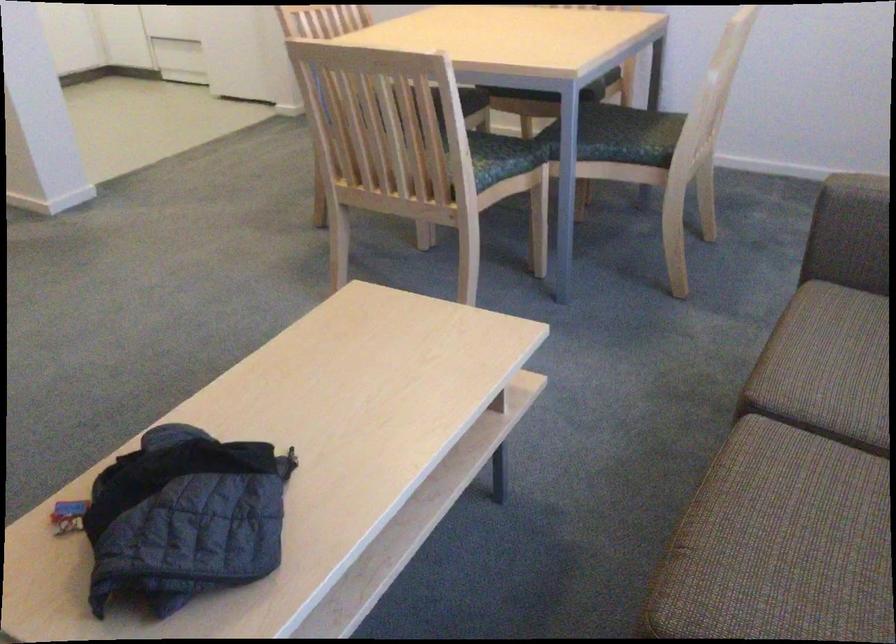
Find the location of `grey sofa sitting surface`. grey sofa sitting surface is located at coordinates (794, 489).